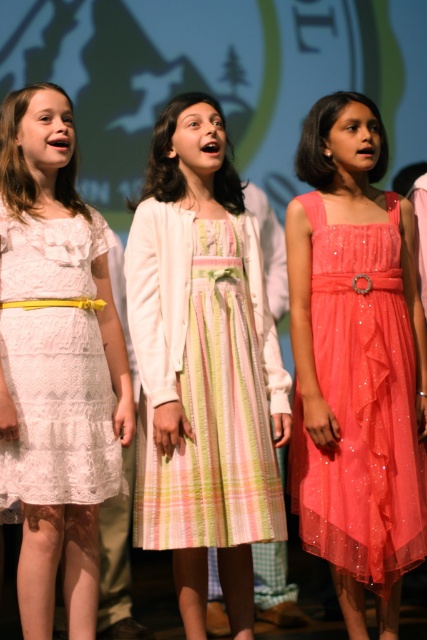
Does pastel plaid dress at center lie behind white lace dress at left?

That is True.

Between point (167, 301) and point (102, 451), which one is positioned in front?

Positioned in front is point (102, 451).

At what (x,y) coordinates should I click in order to perform the action: click on pastel plaid dress at center. Please return your answer as a coordinate pair (x, y). The width and height of the screenshot is (427, 640). Looking at the image, I should click on (x=204, y=381).

Does pastel plaid dress at center have a lesser height compared to shiny coral tulle dress at center?

Indeed, pastel plaid dress at center has a lesser height compared to shiny coral tulle dress at center.

Image resolution: width=427 pixels, height=640 pixels. Describe the element at coordinates (204, 381) in the screenshot. I see `pastel plaid dress at center` at that location.

Where is `pastel plaid dress at center`? This screenshot has width=427, height=640. pastel plaid dress at center is located at coordinates (204, 381).

You are a GUI agent. You are given a task and a screenshot of the screen. Output one action in this format:
    pyautogui.click(x=<x>, y=<y>)
    Task: Click on the pastel plaid dress at center
    The width and height of the screenshot is (427, 640).
    Given the screenshot: What is the action you would take?
    pyautogui.click(x=204, y=381)

Can you confirm if shiny coral tulle dress at center is thinner than white lace dress at left?

In fact, shiny coral tulle dress at center might be wider than white lace dress at left.

Who is higher up, shiny coral tulle dress at center or white lace dress at left?

white lace dress at left is higher up.

This screenshot has height=640, width=427. What do you see at coordinates (360, 406) in the screenshot? I see `shiny coral tulle dress at center` at bounding box center [360, 406].

This screenshot has height=640, width=427. What are the coordinates of `shiny coral tulle dress at center` in the screenshot? It's located at (360, 406).